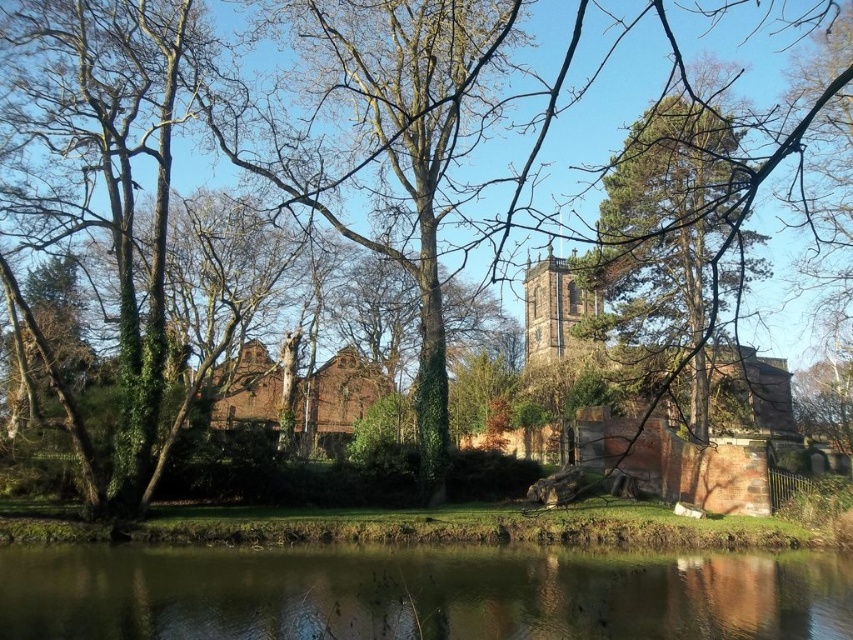
Does green leafy tree at center appear under brown brick church at center?

No, green leafy tree at center is not below brown brick church at center.

Which is behind, point (706, 438) or point (318, 378)?

The point (318, 378) is more distant.

Which is in front, point (741, 276) or point (334, 355)?

Point (741, 276) is more forward.

At what (x,y) coordinates should I click in order to perform the action: click on green leafy tree at center. Please return your answer as a coordinate pair (x, y). Looking at the image, I should click on (670, 252).

Who is taller, green reflective water at bottom or brown brick church at center?

With more height is brown brick church at center.

Does green reflective water at bottom have a smaller size compared to brown brick church at center?

Indeed, green reflective water at bottom has a smaller size compared to brown brick church at center.

Identify the location of green reflective water at bottom. (418, 593).

Which is behind, point (819, 588) or point (712, 179)?

Positioned behind is point (712, 179).

I want to click on green reflective water at bottom, so click(418, 593).